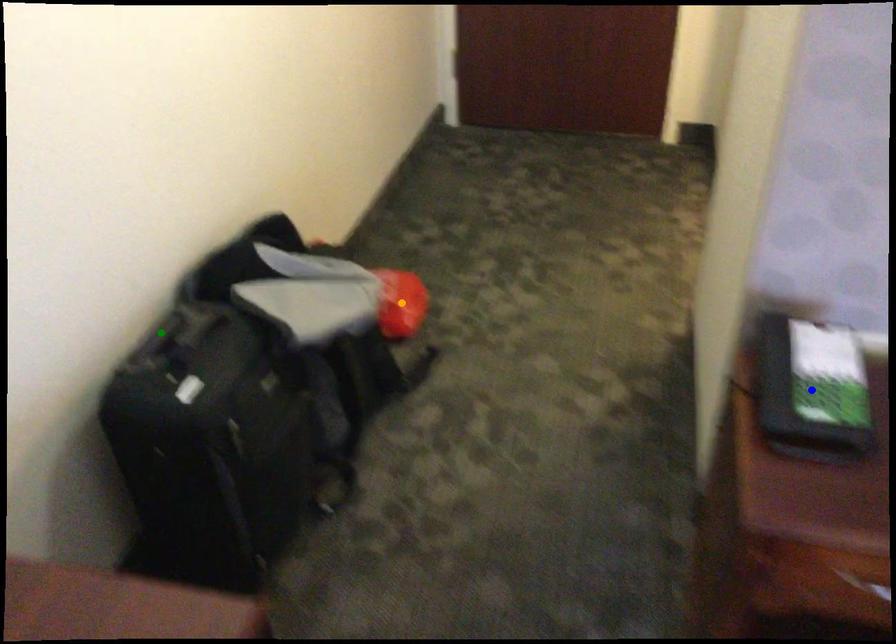
In the scene shown: Order these from nearest to farthest:
1. orange point
2. green point
3. blue point

blue point
green point
orange point